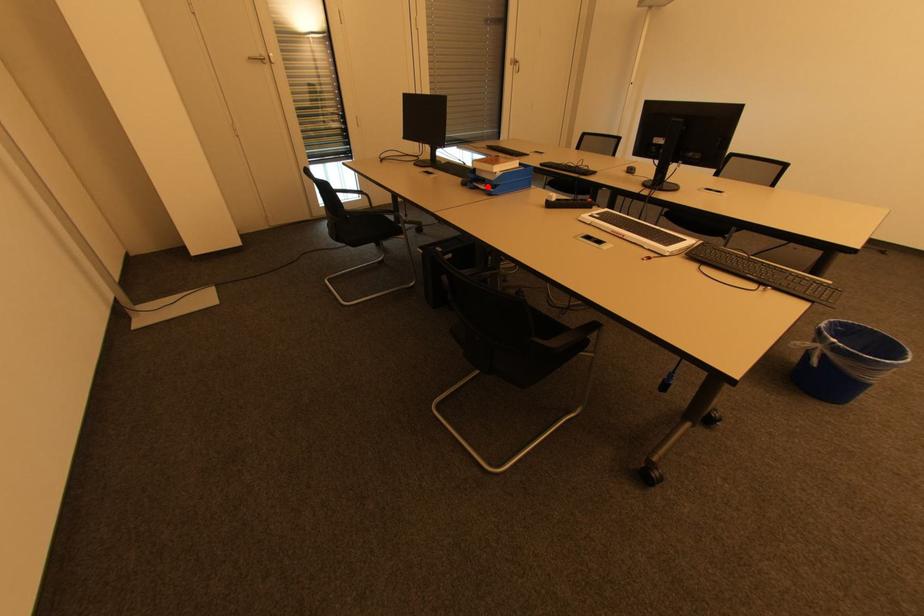
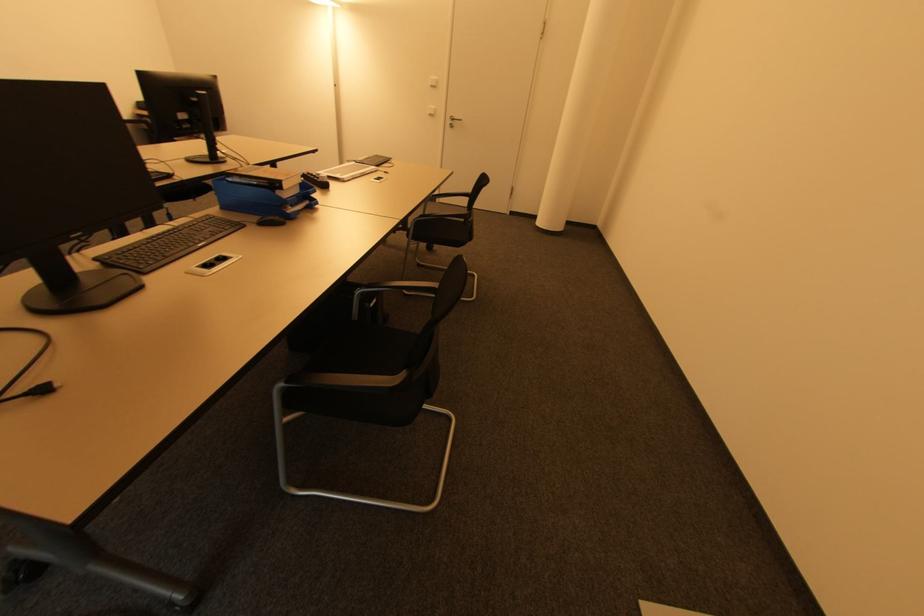
Question: I am providing you with two images of the same scene from different viewpoints. A red point is marked on the first image. At the location where the point appears in image 1, is it still visible in image 2?

Choices:
 (A) Yes
 (B) No

Answer: (A)